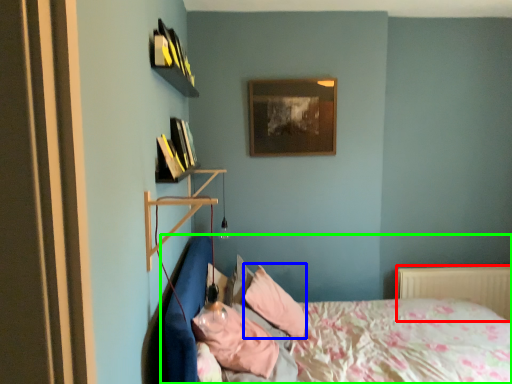
Question: Based on their relative distances, which object is farther from radiator (highlighted by a red box)? Choose from pillow (highlighted by a blue box) and bed (highlighted by a green box).

Choices:
 (A) pillow
 (B) bed

Answer: (A)